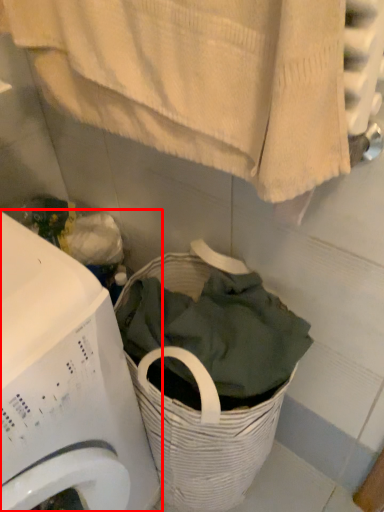
Question: From the image's perspective, where is washing machine (annotated by the red box) located in relation to bath towel in the image?

Choices:
 (A) below
 (B) above

Answer: (A)